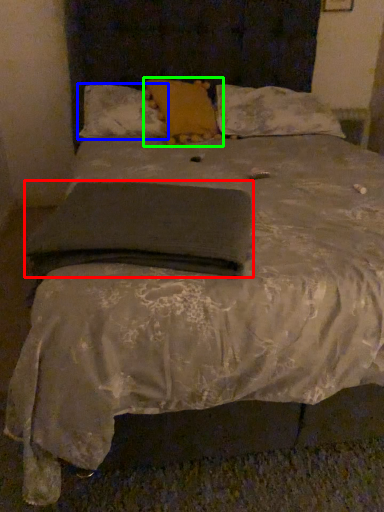
Question: Considering the real-world distances, which object is farthest from pad (highlighted by a red box)? pillow (highlighted by a blue box) or pillow (highlighted by a green box)?

Choices:
 (A) pillow
 (B) pillow

Answer: (A)